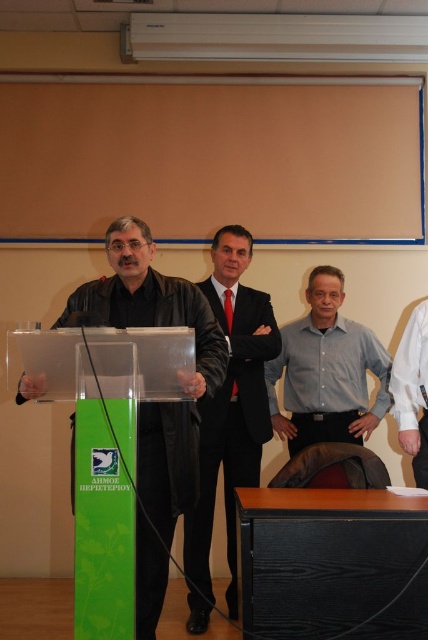
Question: Which point is closer to the camera?

Choices:
 (A) (270, 410)
 (B) (419, 579)
 (C) (151, 292)
 (D) (196, 563)

Answer: (B)

Question: Can you confirm if green wood podium at center is thinner than black leather jacket at center?

Choices:
 (A) no
 (B) yes

Answer: (B)

Question: Considering the relative positions of black suit at center and light blue shirt at center in the image provided, where is black suit at center located with respect to light blue shirt at center?

Choices:
 (A) right
 (B) left

Answer: (B)

Question: Which object is positioned farthest from the light blue shirt at center?

Choices:
 (A) green wood podium at center
 (B) black leather jacket at center

Answer: (A)

Question: Estimate the real-world distances between objects in this image. Which object is farther from the black suit at center?

Choices:
 (A) green wood podium at center
 (B) light blue shirt at center
 (C) black leather jacket at center

Answer: (A)

Question: Is green wood podium at center to the left of black leather jacket at center from the viewer's perspective?

Choices:
 (A) yes
 (B) no

Answer: (B)